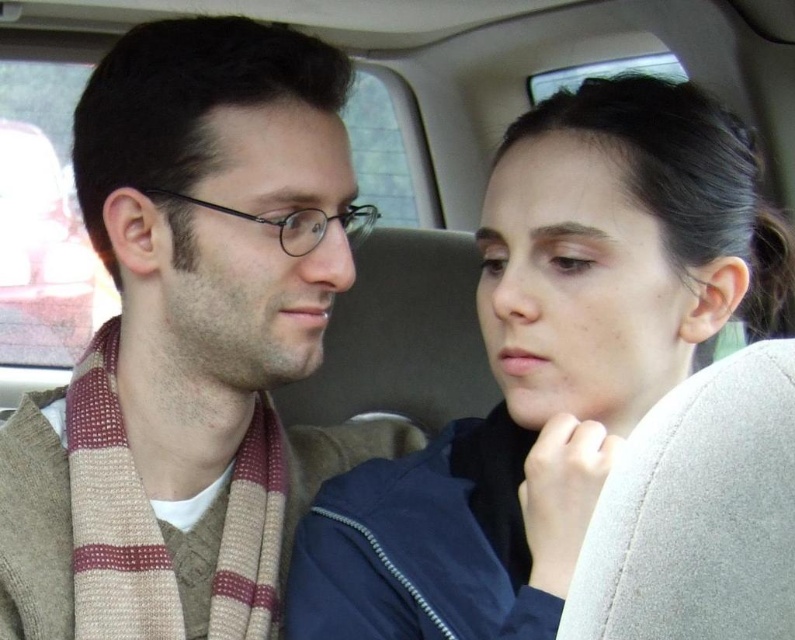
You are designing a new car seat cover that needs to fit over both the smooth navy blue jacket at center and the gray fabric at upper right. Based on the scene description, which object requires a wider seat cover? Please explain your reasoning.

The smooth navy blue jacket at center requires a wider seat cover because its width is larger than the gray fabric at upper right.